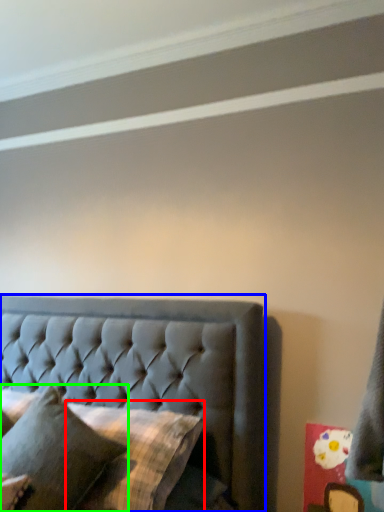
Question: Based on their relative distances, which object is farther from pillow (highlighted by a red box)? Choose from bed (highlighted by a blue box) and pillow (highlighted by a green box).

Choices:
 (A) bed
 (B) pillow

Answer: (A)